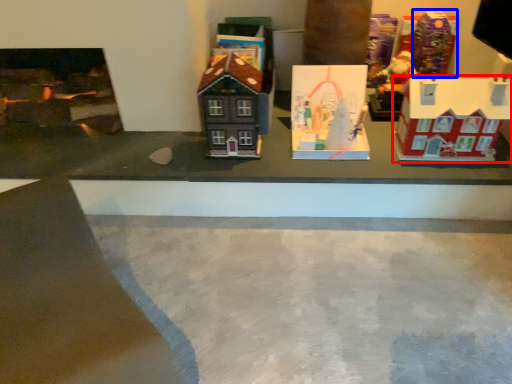
Question: Which object appears closest to the camera in this image, toy (highlighted by a red box) or toy (highlighted by a blue box)?

Choices:
 (A) toy
 (B) toy

Answer: (A)